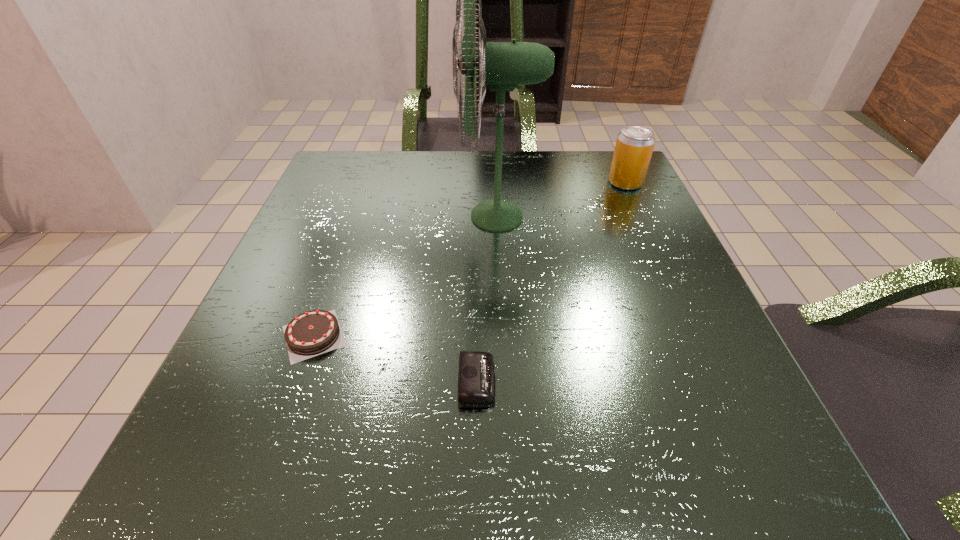
Where is `fan`? This screenshot has width=960, height=540. fan is located at coordinates (502, 65).

Identify the location of the second tallest object. (634, 146).

Where is `the rightmost object`? the rightmost object is located at coordinates (634, 146).

Locate an element on the screen. The image size is (960, 540). chocolate cake is located at coordinates (315, 332).

This screenshot has height=540, width=960. I want to click on the second shortest object, so tap(315, 332).

Locate an element on the screen. The height and width of the screenshot is (540, 960). alarm clock is located at coordinates (x=476, y=373).

You are a GUI agent. You are given a task and a screenshot of the screen. Output one action in this format:
    pyautogui.click(x=<x>, y=<y>)
    Task: Click on the vacant space located on the front-facing side of the fan
    Image resolution: width=960 pixels, height=540 pixels.
    Given the screenshot: What is the action you would take?
    pyautogui.click(x=396, y=216)

Identify the location of vacant region located 0.240m on the front-facing side of the fan. This screenshot has width=960, height=540. (342, 216).

Where is `free space located on the front-facing side of the fan`? The width and height of the screenshot is (960, 540). free space located on the front-facing side of the fan is located at coordinates (323, 216).

This screenshot has width=960, height=540. In order to click on vacant space located 0.320m on the front of the rightmost object in this screenshot , I will do pyautogui.click(x=677, y=296).